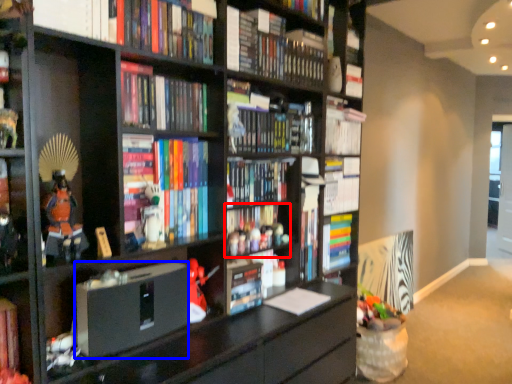
Question: Which object is further to the camera taking this photo, book (highlighted by a red box) or paperback book (highlighted by a blue box)?

Choices:
 (A) book
 (B) paperback book

Answer: (A)